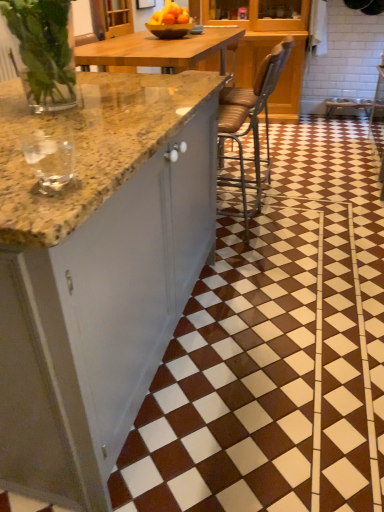
This screenshot has width=384, height=512. I want to click on free region under brown leather chair at center (from a real-world perspective), so click(248, 225).